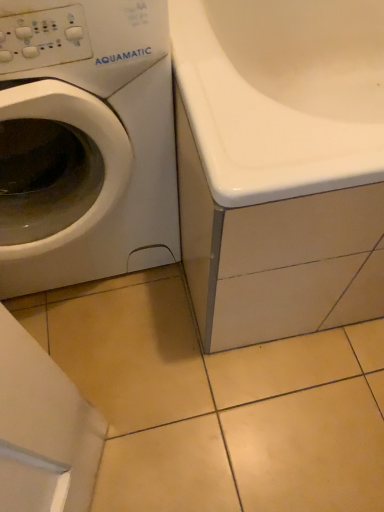
Question: Is white glossy bathtub at center at the left side of white matte washing machine at left?

Choices:
 (A) yes
 (B) no

Answer: (B)

Question: Would you consider white glossy bathtub at center to be distant from white matte washing machine at left?

Choices:
 (A) yes
 (B) no

Answer: (B)

Question: From the image's perspective, would you say white glossy bathtub at center is shown under white matte washing machine at left?

Choices:
 (A) no
 (B) yes

Answer: (A)

Question: Can you confirm if white glossy bathtub at center is bigger than white matte washing machine at left?

Choices:
 (A) yes
 (B) no

Answer: (A)

Question: Is white glossy bathtub at center in contact with white matte washing machine at left?

Choices:
 (A) yes
 (B) no

Answer: (B)

Question: Is white glossy bathtub at center shorter than white matte washing machine at left?

Choices:
 (A) no
 (B) yes

Answer: (B)

Question: Does white matte washing machine at left have a greater height compared to white glossy bathtub at center?

Choices:
 (A) no
 (B) yes

Answer: (B)

Question: Is white matte washing machine at left smaller than white glossy bathtub at center?

Choices:
 (A) no
 (B) yes

Answer: (B)

Question: Does white matte washing machine at left have a greater width compared to white glossy bathtub at center?

Choices:
 (A) no
 (B) yes

Answer: (A)

Question: From the image's perspective, is white matte washing machine at left under white glossy bathtub at center?

Choices:
 (A) yes
 (B) no

Answer: (A)

Question: Is white matte washing machine at left to the left of white glossy bathtub at center from the viewer's perspective?

Choices:
 (A) no
 (B) yes

Answer: (B)

Question: Considering the relative sizes of white matte washing machine at left and white glossy bathtub at center in the image provided, is white matte washing machine at left bigger than white glossy bathtub at center?

Choices:
 (A) no
 (B) yes

Answer: (A)

Question: Is white glossy bathtub at center taller or shorter than white matte washing machine at left?

Choices:
 (A) tall
 (B) short

Answer: (B)